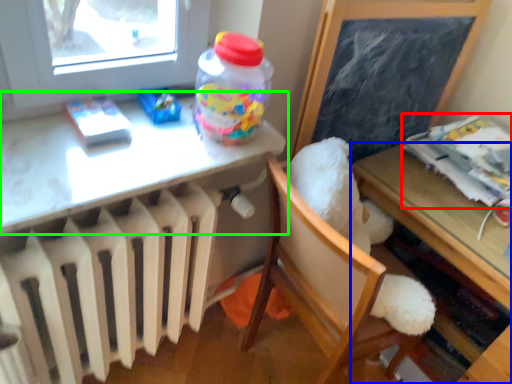
Question: Which is farther away from magazine (highlighted by a red box)? table (highlighted by a blue box) or table (highlighted by a green box)?

Choices:
 (A) table
 (B) table

Answer: (B)